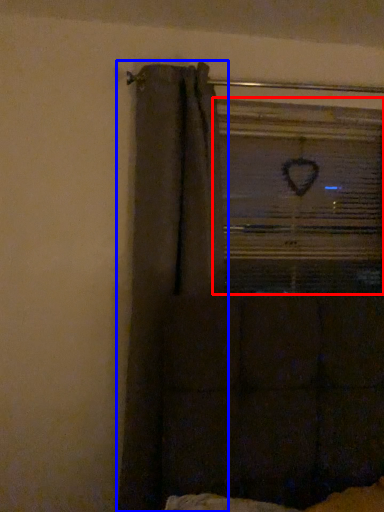
Question: Which object is further to the camera taking this photo, window frame (highlighted by a red box) or curtain (highlighted by a blue box)?

Choices:
 (A) window frame
 (B) curtain

Answer: (A)